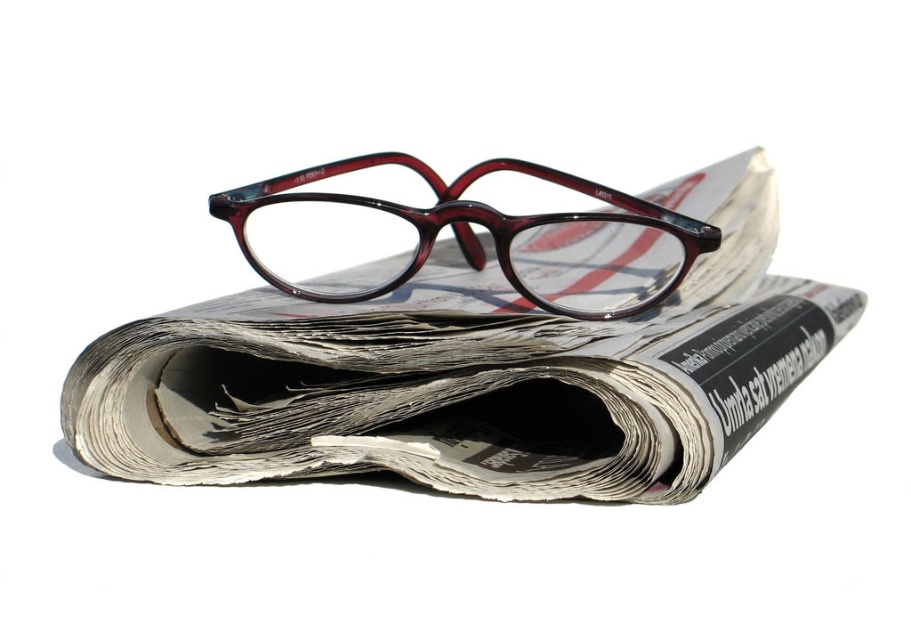
You are a delivery person who needs to place both the white printed newspaper at center and the translucent maroon plastic glasses at center into a box. The box has a height limit of 10 cm. Can both items fit vertically without exceeding the height limit?

The white printed newspaper at center is taller than the translucent maroon plastic glasses at center. However, since the box has a height limit of 10 cm, we need to know the exact heights of both items. Unfortunately, the description does not provide specific measurements for their heights, so it is impossible to determine if they will fit vertically within the 10 cm limit without additional information.

You have to place both the white printed newspaper at center and the translucent maroon plastic glasses at center into a storage box. The box can only accommodate items up to the size of the newspaper. Which item will fit without any issues?

The white printed newspaper at center will fit without any issues since its width is larger than the translucent maroon plastic glasses at center, meaning the glasses are smaller and will fit within the box designed for the newspaper.